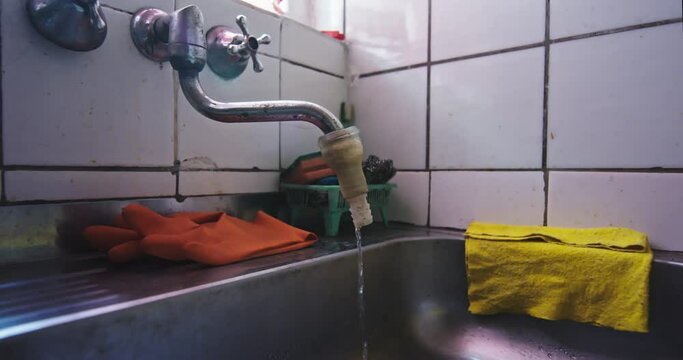
This screenshot has height=360, width=683. In order to click on grout in this screenshot , I will do `click(546, 163)`.